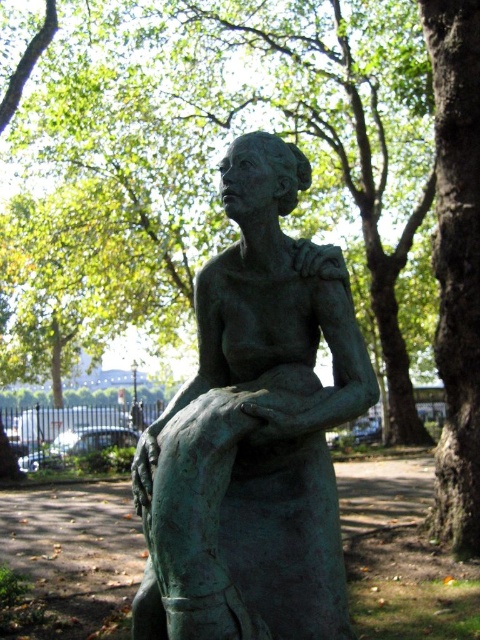
Question: Based on their relative distances, which object is farther from the green patina bronze statue at center?

Choices:
 (A) green patina tree at center
 (B) green rough bark tree at center right

Answer: (A)

Question: Which point is farther from the camera taking this photo?

Choices:
 (A) (334, 161)
 (B) (472, 488)
 (C) (282, 577)

Answer: (A)

Question: Does green patina bronze statue at center come in front of green rough bark tree at center right?

Choices:
 (A) no
 (B) yes

Answer: (B)

Question: Where is green patina tree at center located in relation to green rough bark tree at center right in the image?

Choices:
 (A) above
 (B) below

Answer: (A)

Question: Is green patina tree at center to the right of green patina bronze statue at center from the viewer's perspective?

Choices:
 (A) yes
 (B) no

Answer: (B)

Question: Which point is farther to the camera?

Choices:
 (A) [170, 186]
 (B) [182, 449]

Answer: (A)